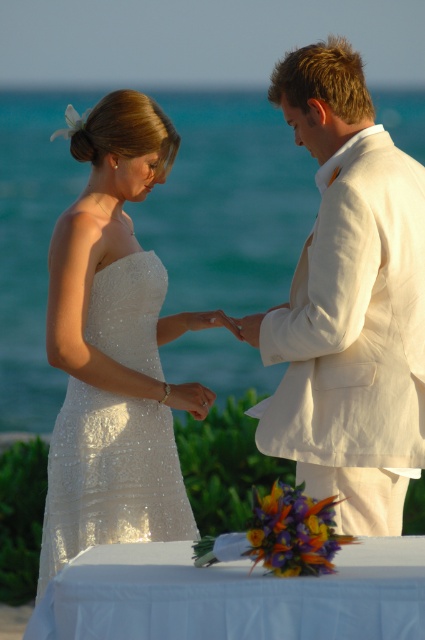
Can you confirm if white linen suit at center is positioned to the right of white sequined dress at left?

Indeed, white linen suit at center is positioned on the right side of white sequined dress at left.

Between white linen suit at center and white sequined dress at left, which one is positioned lower?

white sequined dress at left

Who is more distant from viewer, (280, 332) or (45, 333)?

Point (45, 333)

Locate an element on the screen. The image size is (425, 640). white linen suit at center is located at coordinates (348, 301).

Is white sequined dress at left to the left of silver metallic ring at center from the viewer's perspective?

Yes, white sequined dress at left is to the left of silver metallic ring at center.

Is white sequined dress at left positioned at the back of silver metallic ring at center?

No, it is not.

Is point (169, 520) in front of point (204, 404)?

That is True.

Locate an element on the screen. white sequined dress at left is located at coordinates (115, 346).

Can you confirm if white linen suit at center is positioned below silver metallic ring at center?

Incorrect, white linen suit at center is not positioned below silver metallic ring at center.

Is white linen suit at center positioned before silver metallic ring at center?

Yes, it is in front of silver metallic ring at center.

The height and width of the screenshot is (640, 425). What are the coordinates of `white linen suit at center` in the screenshot? It's located at (348, 301).

The height and width of the screenshot is (640, 425). In order to click on white linen suit at center in this screenshot , I will do `click(348, 301)`.